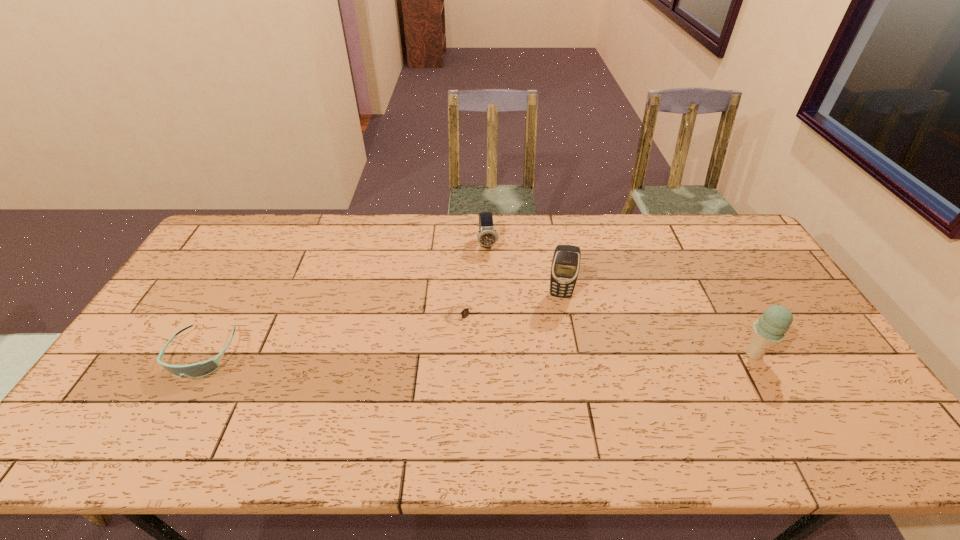
The width and height of the screenshot is (960, 540). Find the location of `vacant area that lies between the fourth object from left to right and the rightmost object`. vacant area that lies between the fourth object from left to right and the rightmost object is located at coordinates (657, 325).

I want to click on empty space between the ice cream and the cellular telephone, so point(657,325).

This screenshot has width=960, height=540. What are the coordinates of `vacant space that's between the farther watch and the ice cream` in the screenshot? It's located at (620, 299).

Where is `free point between the rightmost object and the leftmost object`? free point between the rightmost object and the leftmost object is located at coordinates (478, 354).

In order to click on free area in between the rightmost object and the goggles in this screenshot , I will do `click(478, 354)`.

Identify the location of free space between the rightmost object and the cellular telephone. This screenshot has width=960, height=540. (657, 325).

At what (x,y) coordinates should I click in order to perform the action: click on vacant area that lies between the taller watch and the rightmost object. Please return your answer as a coordinate pair (x, y). The width and height of the screenshot is (960, 540). Looking at the image, I should click on (620, 299).

Where is `the fourth closest object relative to the nearer watch`? Image resolution: width=960 pixels, height=540 pixels. the fourth closest object relative to the nearer watch is located at coordinates (770, 329).

Where is `the fourth closest object to the ice cream`? the fourth closest object to the ice cream is located at coordinates (200, 369).

You are a GUI agent. You are given a task and a screenshot of the screen. Output one action in this format:
    pyautogui.click(x=<x>, y=<y>)
    Task: Click on the vacant region that satisfies the following two spatial constraints: 1. on the back side of the farthest object; 2. on the left side of the nearer watch
    
    Given the screenshot: What is the action you would take?
    pyautogui.click(x=464, y=244)